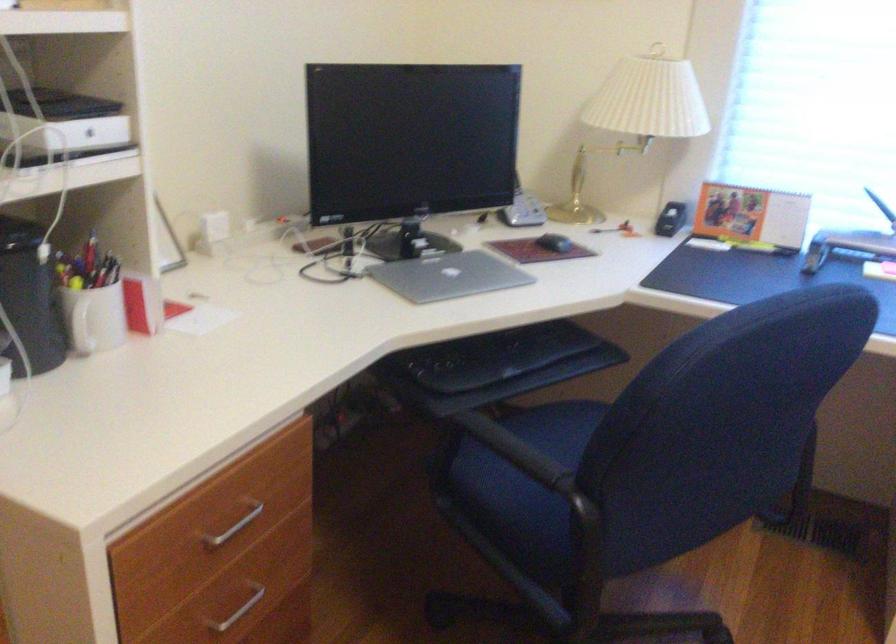
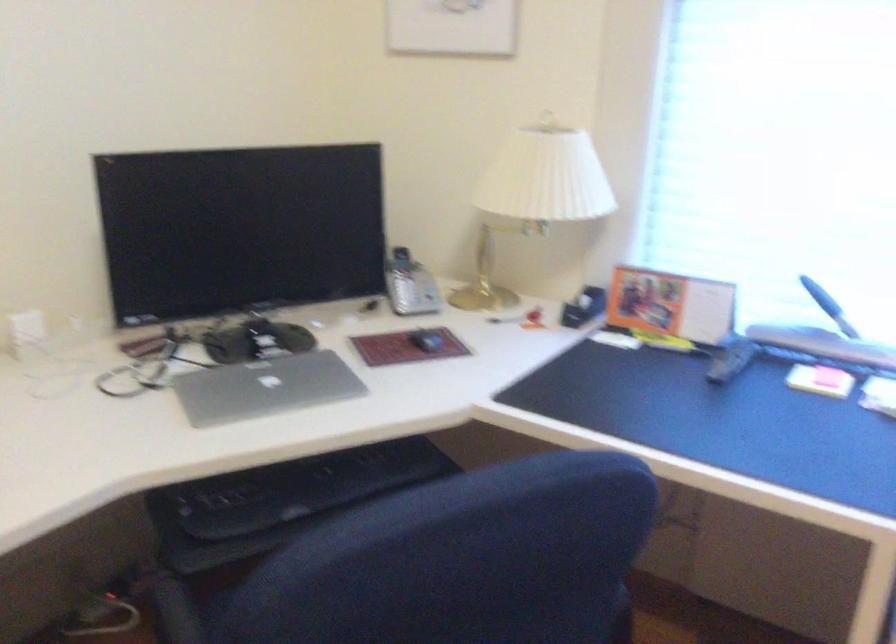
Find the pixel in the second image that matches point 501,355 in the first image.

(302, 488)